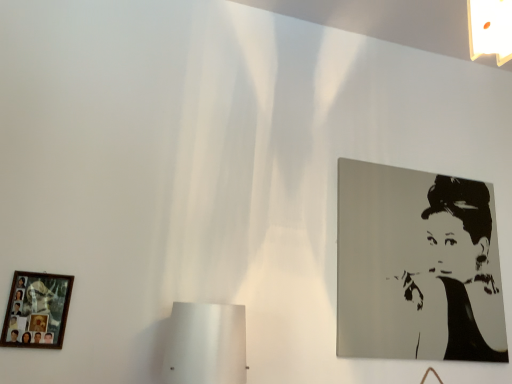
Question: Considering the positions of point (59, 289) and point (356, 198), is point (59, 289) closer or farther from the camera than point (356, 198)?

Choices:
 (A) farther
 (B) closer

Answer: (B)

Question: Do you think wooden photo frame at lower left, the 1th picture frame when ordered from front to back, is within black glossy portrait at upper right, the 2th picture frame positioned from the front, or outside of it?

Choices:
 (A) outside
 (B) inside

Answer: (A)

Question: In the image, is wooden photo frame at lower left, the first picture frame when ordered from left to right, on the left side or the right side of black glossy portrait at upper right, acting as the first picture frame starting from the back?

Choices:
 (A) right
 (B) left

Answer: (B)

Question: Is black glossy portrait at upper right, the 2th picture frame from the left, bigger or smaller than wooden photo frame at lower left, the first picture frame when ordered from left to right?

Choices:
 (A) small
 (B) big

Answer: (B)

Question: In the image, is black glossy portrait at upper right, which is counted as the first picture frame, starting from the right, on the left side or the right side of wooden photo frame at lower left, the 1th picture frame when ordered from front to back?

Choices:
 (A) left
 (B) right

Answer: (B)

Question: From the image's perspective, relative to wooden photo frame at lower left, the 1th picture frame when ordered from front to back, is black glossy portrait at upper right, acting as the first picture frame starting from the back, above or below?

Choices:
 (A) below
 (B) above

Answer: (B)

Question: From their relative heights in the image, would you say black glossy portrait at upper right, the 2th picture frame from the left, is taller or shorter than wooden photo frame at lower left, marked as the second picture frame in a right-to-left arrangement?

Choices:
 (A) tall
 (B) short

Answer: (A)